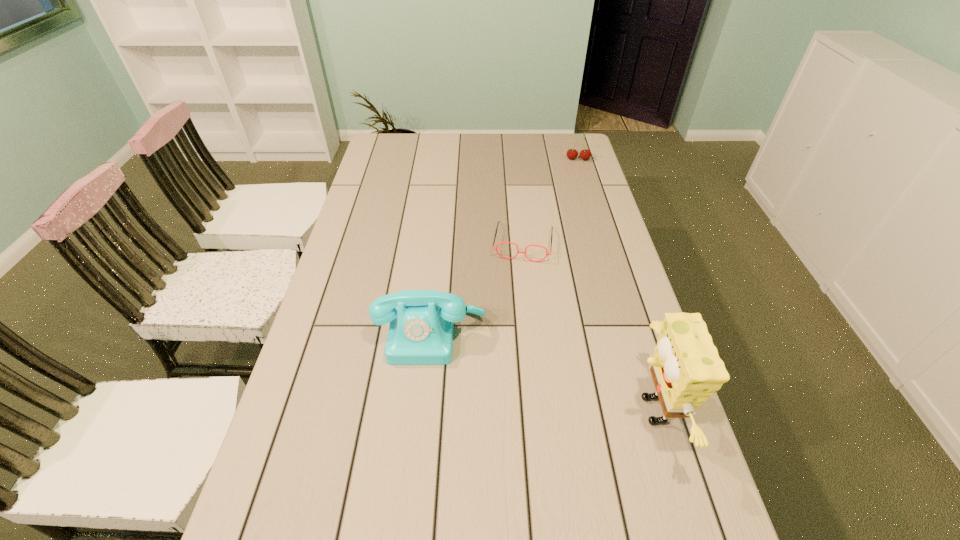
In order to click on object at the far right corner in this screenshot , I will do `click(585, 154)`.

In the image, there is a desktop. Where is `blank space at the near edge`? The height and width of the screenshot is (540, 960). blank space at the near edge is located at coordinates (396, 532).

At what (x,y) coordinates should I click in order to perform the action: click on vacant space at the left edge. Please return your answer as a coordinate pair (x, y). Image resolution: width=960 pixels, height=540 pixels. Looking at the image, I should click on (364, 285).

This screenshot has width=960, height=540. I want to click on vacant region at the right edge of the desktop, so click(x=580, y=210).

Locate an element on the screen. This screenshot has width=960, height=540. blank area at the far left corner is located at coordinates (398, 144).

This screenshot has width=960, height=540. I want to click on vacant area at the near right corner of the desktop, so click(x=693, y=496).

Locate an element on the screen. free spot between the second shortest object and the tallest object is located at coordinates (613, 285).

At what (x,y) coordinates should I click in order to perform the action: click on vacant space that's between the spectacles and the cherry. Please return your answer as a coordinate pair (x, y). The image size is (960, 540). Looking at the image, I should click on coord(550,201).

At what (x,y) coordinates should I click in order to perform the action: click on free spot between the tallest object and the leftmost object. Please return your answer as a coordinate pair (x, y). Image resolution: width=960 pixels, height=540 pixels. Looking at the image, I should click on (540, 372).

The height and width of the screenshot is (540, 960). Find the location of `free space between the sponge and the spectacles`. free space between the sponge and the spectacles is located at coordinates (587, 327).